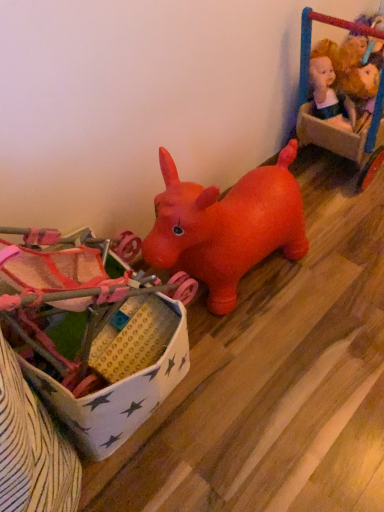
Describe the element at coordinates (101, 342) in the screenshot. I see `matte plastic toy at center, the third toy in the right-to-left sequence` at that location.

The width and height of the screenshot is (384, 512). What do you see at coordinates (311, 39) in the screenshot?
I see `velvet plush doll at upper right, the 1th toy viewed from the top` at bounding box center [311, 39].

Measure the distance between point (360, 90) and camera.

The depth of point (360, 90) is 1.35 meters.

Locate an element on the screen. matte plastic toy at center, the 3th toy when ordered from top to bottom is located at coordinates (101, 342).

Is velvet plush doll at upper right, acting as the 1th toy starting from the right, at the back of plush yellow doll at upper right, which is the 2th toy from top to bottom?

That's right, plush yellow doll at upper right, which is the 2th toy from top to bottom, is facing away from velvet plush doll at upper right, acting as the 1th toy starting from the right.

Do you think plush yellow doll at upper right, placed as the second toy when sorted from bottom to top, is within velvet plush doll at upper right, acting as the 1th toy starting from the right, or outside of it?

plush yellow doll at upper right, placed as the second toy when sorted from bottom to top, lies within the bounds of velvet plush doll at upper right, acting as the 1th toy starting from the right.

Who is taller, plush yellow doll at upper right, positioned as the 2th toy in left-to-right order, or velvet plush doll at upper right, acting as the 1th toy starting from the right?

velvet plush doll at upper right, acting as the 1th toy starting from the right, is taller.

From a real-world perspective, is plush yellow doll at upper right, which ranks as the 2th toy in right-to-left order, physically above velvet plush doll at upper right, the 1th toy viewed from the top?

No, from a real-world perspective, plush yellow doll at upper right, which ranks as the 2th toy in right-to-left order, is not over velvet plush doll at upper right, the 1th toy viewed from the top

How different are the orientations of matte plastic toy at center, marked as the first toy in a left-to-right arrangement, and velvet plush doll at upper right, the 1th toy viewed from the top, in degrees?

matte plastic toy at center, marked as the first toy in a left-to-right arrangement, and velvet plush doll at upper right, the 1th toy viewed from the top, are facing 0.000399 degrees away from each other.

Is point (83, 304) more distant than point (302, 29)?

No, it is not.

Is matte plastic toy at center, which is the 1th toy from bottom to top, aimed at velvet plush doll at upper right, the 3th toy ordered from the bottom?

No, matte plastic toy at center, which is the 1th toy from bottom to top, is not aimed at velvet plush doll at upper right, the 3th toy ordered from the bottom.

In the scene shown: Is matte plastic toy at center, the third toy in the right-to-left sequence, at the left side of velvet plush doll at upper right, the 3th toy ordered from the bottom?

Indeed, matte plastic toy at center, the third toy in the right-to-left sequence, is positioned on the left side of velvet plush doll at upper right, the 3th toy ordered from the bottom.

Measure the distance between matte plastic toy at center, the 3th toy when ordered from top to bottom, and plush yellow doll at upper right, which is the 2th toy from top to bottom.

A distance of 3.52 feet exists between matte plastic toy at center, the 3th toy when ordered from top to bottom, and plush yellow doll at upper right, which is the 2th toy from top to bottom.

From the image's perspective, is matte plastic toy at center, marked as the first toy in a left-to-right arrangement, over plush yellow doll at upper right, which ranks as the 2th toy in right-to-left order?

No, from the image's perspective, matte plastic toy at center, marked as the first toy in a left-to-right arrangement, is not on top of plush yellow doll at upper right, which ranks as the 2th toy in right-to-left order.

Between matte plastic toy at center, the third toy in the right-to-left sequence, and plush yellow doll at upper right, positioned as the 2th toy in left-to-right order, which one has smaller width?

With smaller width is plush yellow doll at upper right, positioned as the 2th toy in left-to-right order.

From a real-world perspective, who is located lower, matte plastic toy at center, the third toy in the right-to-left sequence, or plush yellow doll at upper right, placed as the second toy when sorted from bottom to top?

From a 3D spatial view, matte plastic toy at center, the third toy in the right-to-left sequence, is below.

From the picture: Which object is closer to the camera taking this photo, velvet plush doll at upper right, the 1th toy viewed from the top, or matte plastic toy at center, the 3th toy when ordered from top to bottom?

Positioned in front is matte plastic toy at center, the 3th toy when ordered from top to bottom.

From a real-world perspective, is velvet plush doll at upper right, the third toy positioned from the left, beneath matte plastic toy at center, which is the 1th toy from bottom to top?

No, from a real-world perspective, velvet plush doll at upper right, the third toy positioned from the left, is not below matte plastic toy at center, which is the 1th toy from bottom to top.

Identify the location of toy that is the 2nd object located below the velvet plush doll at upper right, acting as the 1th toy starting from the right (from the image's perspective). (101, 342).

Considering the sizes of objects plush yellow doll at upper right, which ranks as the 2th toy in right-to-left order, and matte plastic toy at center, the third toy in the right-to-left sequence, in the image provided, who is thinner, plush yellow doll at upper right, which ranks as the 2th toy in right-to-left order, or matte plastic toy at center, the third toy in the right-to-left sequence,?

Thinner between the two is plush yellow doll at upper right, which ranks as the 2th toy in right-to-left order.

How different are the orientations of plush yellow doll at upper right, which ranks as the 2th toy in right-to-left order, and matte plastic toy at center, the third toy in the right-to-left sequence, in degrees?

88 degrees.

Where is `toy that is the 1st one when counting rightward from the matte plastic toy at center, marked as the first toy in a left-to-right arrangement`? toy that is the 1st one when counting rightward from the matte plastic toy at center, marked as the first toy in a left-to-right arrangement is located at coordinates (362, 86).

Which is behind, point (363, 78) or point (153, 397)?

Positioned behind is point (363, 78).

Consider the image. Is velvet plush doll at upper right, the third toy positioned from the left, at the left side of plush yellow doll at upper right, which ranks as the 2th toy in right-to-left order?

No.

Would you say velvet plush doll at upper right, the third toy positioned from the left, is inside or outside plush yellow doll at upper right, which is the 2th toy from top to bottom?

velvet plush doll at upper right, the third toy positioned from the left, is outside plush yellow doll at upper right, which is the 2th toy from top to bottom.

Is velvet plush doll at upper right, acting as the 1th toy starting from the right, oriented away from plush yellow doll at upper right, which ranks as the 2th toy in right-to-left order?

That's right, velvet plush doll at upper right, acting as the 1th toy starting from the right, is facing away from plush yellow doll at upper right, which ranks as the 2th toy in right-to-left order.

Locate an element on the screen. Image resolution: width=384 pixels, height=512 pixels. the 1st toy below the velvet plush doll at upper right, acting as the 1th toy starting from the right (from the image's perspective) is located at coordinates (362, 86).

What are the coordinates of `the 2nd toy directly beneath the velvet plush doll at upper right, the third toy positioned from the left (from a real-world perspective)` in the screenshot? It's located at (101, 342).

Based on their spatial positions, is plush yellow doll at upper right, which ranks as the 2th toy in right-to-left order, or matte plastic toy at center, which is the 1th toy from bottom to top, further from velvet plush doll at upper right, the third toy positioned from the left?

matte plastic toy at center, which is the 1th toy from bottom to top.

Which object lies further to the anchor point plush yellow doll at upper right, placed as the second toy when sorted from bottom to top, velvet plush doll at upper right, the 1th toy viewed from the top, or matte plastic toy at center, which is the 1th toy from bottom to top?

matte plastic toy at center, which is the 1th toy from bottom to top, is further to plush yellow doll at upper right, placed as the second toy when sorted from bottom to top.

Considering their positions, is plush yellow doll at upper right, positioned as the 2th toy in left-to-right order, positioned further to matte plastic toy at center, the 3th toy when ordered from top to bottom, than velvet plush doll at upper right, the 1th toy viewed from the top?

Based on the image, plush yellow doll at upper right, positioned as the 2th toy in left-to-right order, appears to be further to matte plastic toy at center, the 3th toy when ordered from top to bottom.

Considering their positions, is velvet plush doll at upper right, the 1th toy viewed from the top, positioned further to matte plastic toy at center, which is the 1th toy from bottom to top, than plush yellow doll at upper right, which is the 2th toy from top to bottom?

plush yellow doll at upper right, which is the 2th toy from top to bottom, is positioned further to the anchor matte plastic toy at center, which is the 1th toy from bottom to top.

Estimate the real-world distances between objects in this image. Which object is closer to plush yellow doll at upper right, placed as the second toy when sorted from bottom to top, matte plastic toy at center, the third toy in the right-to-left sequence, or velvet plush doll at upper right, the 3th toy ordered from the bottom?

velvet plush doll at upper right, the 3th toy ordered from the bottom, is positioned closer to the anchor plush yellow doll at upper right, placed as the second toy when sorted from bottom to top.

Estimate the real-world distances between objects in this image. Which object is further from velvet plush doll at upper right, the 3th toy ordered from the bottom, matte plastic toy at center, which is the 1th toy from bottom to top, or plush yellow doll at upper right, which is the 2th toy from top to bottom?

matte plastic toy at center, which is the 1th toy from bottom to top, is further to velvet plush doll at upper right, the 3th toy ordered from the bottom.

This screenshot has width=384, height=512. Identify the location of toy between matte plastic toy at center, the third toy in the right-to-left sequence, and velvet plush doll at upper right, the 1th toy viewed from the top, in the horizontal direction. (362, 86).